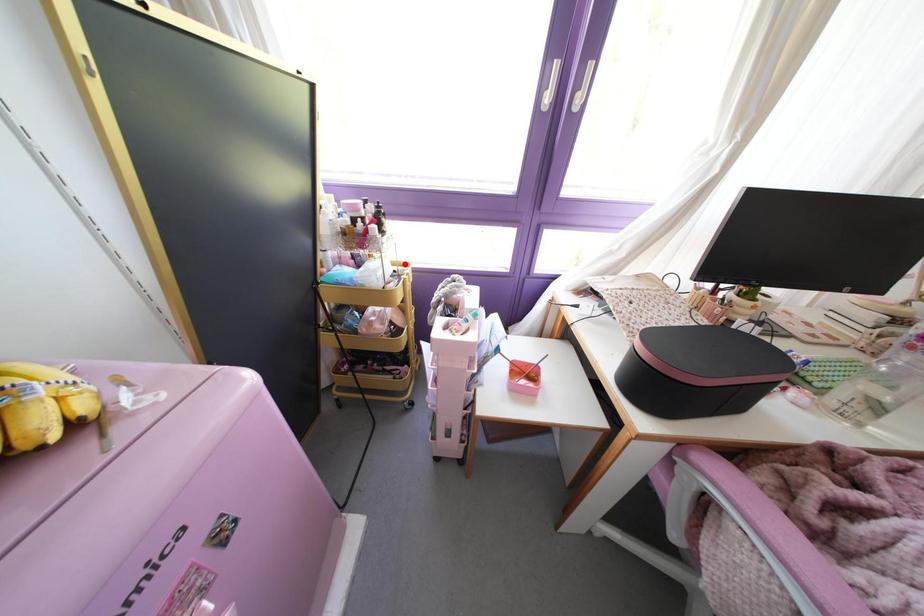
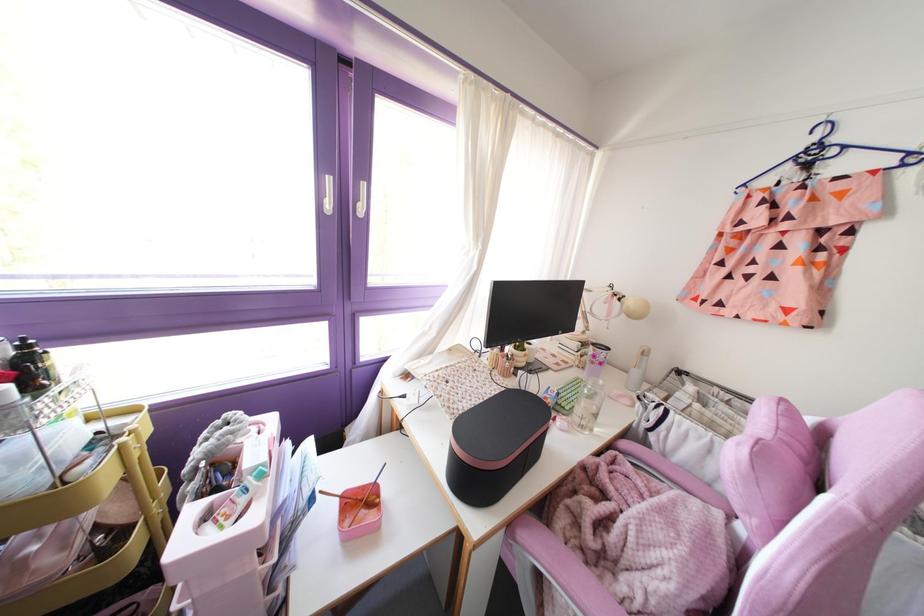
Question: I am providing you with two images of the same scene from different viewpoints. A red point is marked on the first image. At the location where the point appears in image 1, is it still visible in image 2?

Choices:
 (A) Yes
 (B) No

Answer: (A)